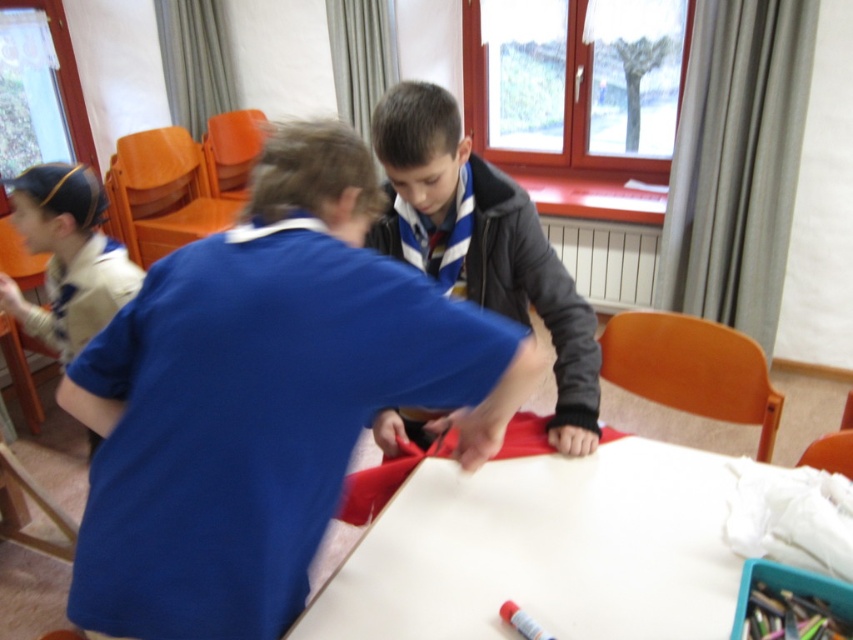
Based on the coordinates provided in the description, where is the white matte table at center located in the image?

The white matte table at center is located at point coordinates of (543, 550).

You are a teacher observing the classroom scene. You notice the blue fabric at center and the dark gray woolen sweater at center on the table. Which object is wider?

The blue fabric at center is wider than the dark gray woolen sweater at center.

You are a teacher in the classroom. You need to place a small craft kit on the table and ensure it doesn not get buried under other items. Which object between the white matte table at center and the dark gray woolen sweater at center should you place the craft kit on?

The white matte table at center has a smaller size compared to the dark gray woolen sweater at center, so placing the craft kit on the white matte table at center would be better to prevent it from being buried under other items.